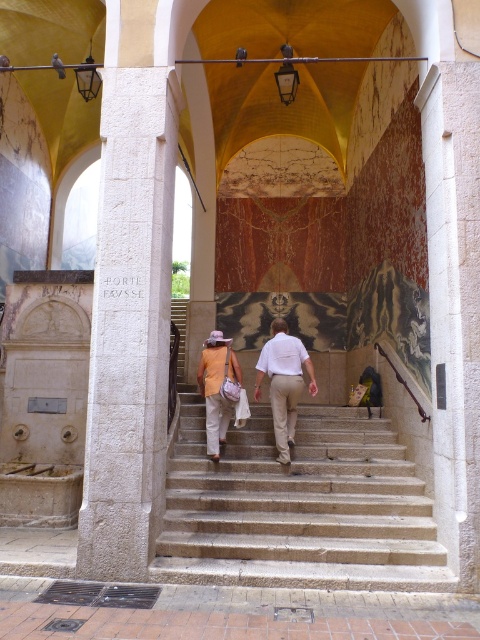
Measure the distance between stone stairs at center and camera.

stone stairs at center and camera are 4.75 meters apart from each other.

In the scene shown: Who is more forward, (167, 564) or (305, 369)?

Point (167, 564)

Locate an element on the screen. stone stairs at center is located at coordinates (299, 506).

Where is `stone stairs at center`? Image resolution: width=480 pixels, height=640 pixels. stone stairs at center is located at coordinates (299, 506).

Is stone stairs at center further to camera compared to matte orange shirt at center?

That is False.

Does point (242, 547) lie in front of point (220, 352)?

Yes, it is in front of point (220, 352).

The width and height of the screenshot is (480, 640). I want to click on stone stairs at center, so click(x=299, y=506).

Who is lower down, white cotton shirt at center or matte orange shirt at center?

matte orange shirt at center is below.

Does white cotton shirt at center come in front of matte orange shirt at center?

Yes, white cotton shirt at center is in front of matte orange shirt at center.

Who is more distant from viewer, [286,412] or [238,374]?

Positioned behind is point [238,374].

At what (x,y) coordinates should I click in order to perform the action: click on white cotton shirt at center. Please return your answer as a coordinate pair (x, y). The width and height of the screenshot is (480, 640). Looking at the image, I should click on (284, 381).